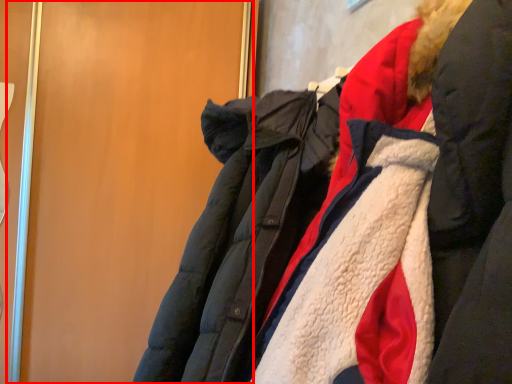
Question: From the image's perspective, what is the correct spatial positioning of door (annotated by the red box) in reference to jacket?

Choices:
 (A) above
 (B) below

Answer: (A)